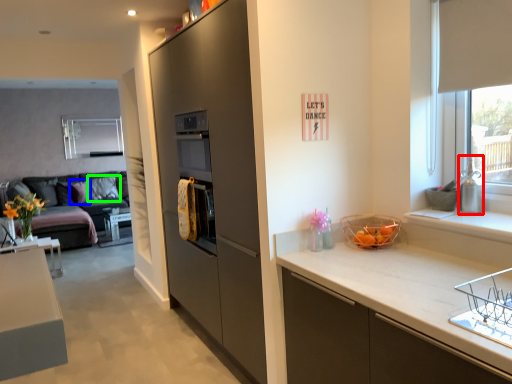
Question: Which is nearer to the appliance (highlighted by a red box)? pillow (highlighted by a blue box) or pillow (highlighted by a green box).

Choices:
 (A) pillow
 (B) pillow

Answer: (B)